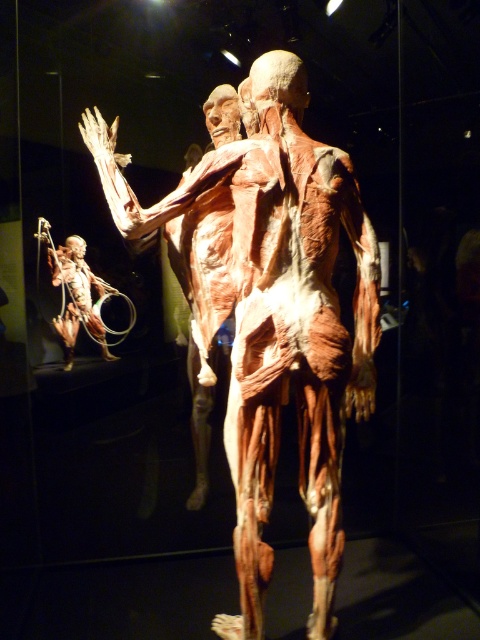
Is point (236, 220) positioned after point (78, 307)?

No, it is in front of (78, 307).

Who is higher up, natural flesh-colored muscle at center or translucent flesh-like figure at lower left?

translucent flesh-like figure at lower left is higher up.

What do you see at coordinates (269, 310) in the screenshot? The width and height of the screenshot is (480, 640). I see `natural flesh-colored muscle at center` at bounding box center [269, 310].

I want to click on natural flesh-colored muscle at center, so click(x=269, y=310).